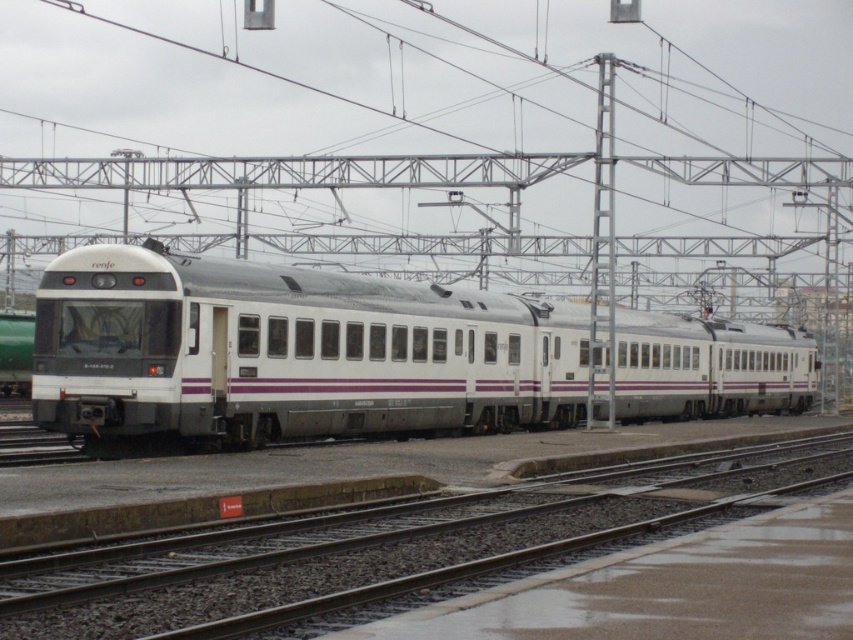
Does white glossy train at center come in front of metal track at center?

No, it is not.

Which is in front, point (113, 285) or point (440, 557)?

Positioned in front is point (440, 557).

Find the location of a particular element. white glossy train at center is located at coordinates (289, 352).